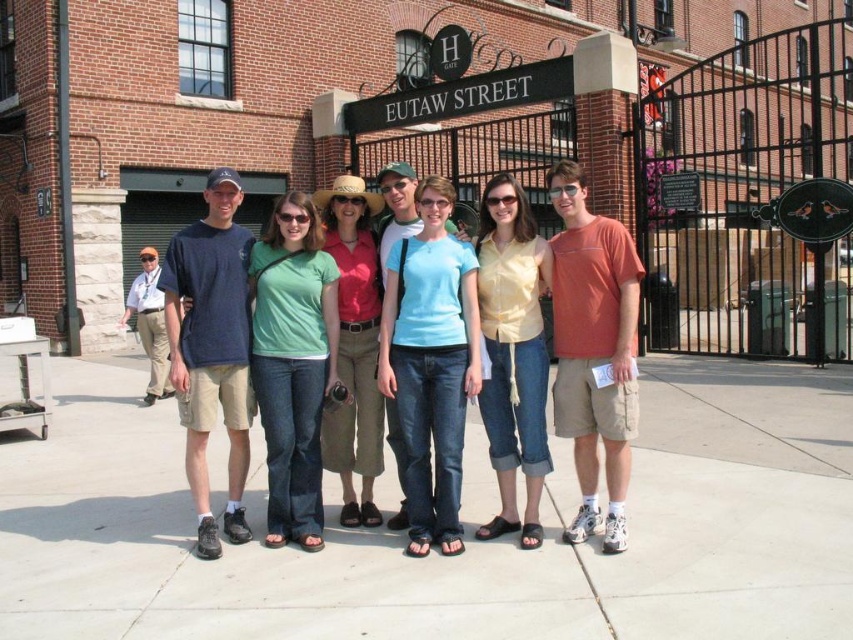
You are a photographer standing at the camera position. You want to adjust the focus to capture the yellow cotton shirt at center clearly. What is the required focusing distance in meters?

The yellow cotton shirt at center is 5.94 meters away from the camera, so the required focusing distance is 5.94 meters.

You are standing in front of the EUTAW STREET building and notice the light gray concrete pavement at center and the orange cotton shirt at center. Which object is positioned lower in the image?

The light gray concrete pavement at center is below the orange cotton shirt at center, so the light gray concrete pavement at center is positioned lower in the image.